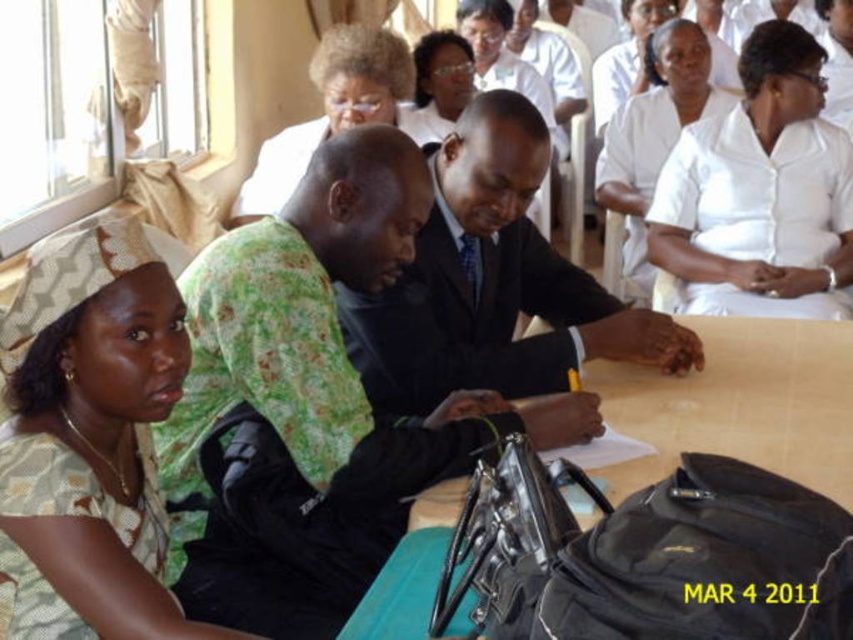
Question: Considering the relative positions of white smooth shirt at upper center and matte white hair at upper center in the image provided, where is white smooth shirt at upper center located with respect to matte white hair at upper center?

Choices:
 (A) left
 (B) right

Answer: (B)

Question: Among these objects, which one is farthest from the camera?

Choices:
 (A) black suit at center
 (B) white smooth blouse at upper center

Answer: (B)

Question: Is green printed shirt at center wider than black suit at center?

Choices:
 (A) yes
 (B) no

Answer: (A)

Question: Estimate the real-world distances between objects in this image. Which object is farther from the wooden table at center?

Choices:
 (A) matte white shirt at upper center
 (B) green printed shirt at center
 (C) matte white hair at upper center

Answer: (A)

Question: Is patterned fabric headscarf at lower left below matte white shirt at upper center?

Choices:
 (A) yes
 (B) no

Answer: (A)

Question: Which point is farther to the camera?

Choices:
 (A) (338, 77)
 (B) (42, 358)

Answer: (A)